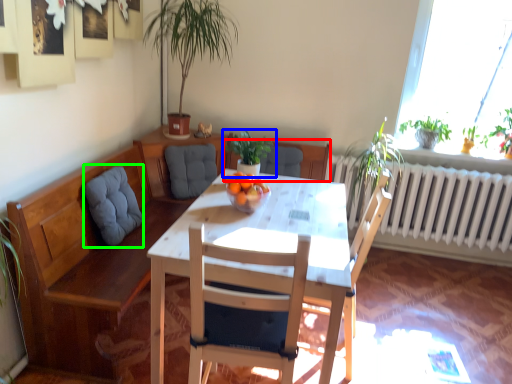
Question: Based on their relative distances, which object is farther from chair (highlighted by a red box)? Choose from houseplant (highlighted by a blue box) and swivel chair (highlighted by a green box).

Choices:
 (A) houseplant
 (B) swivel chair

Answer: (B)